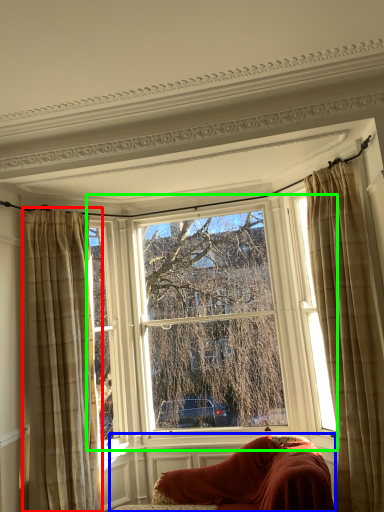
Question: Which object is positioned farthest from curtain (highlighted by a red box)? Select from furniture (highlighted by a blue box) and window (highlighted by a green box).

Choices:
 (A) furniture
 (B) window

Answer: (A)